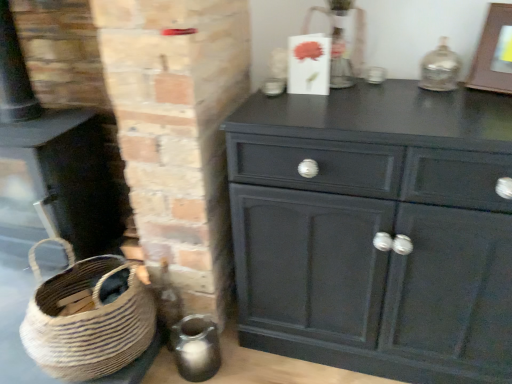
Image resolution: width=512 pixels, height=384 pixels. Find the location of `vacant space that is to the left of wooden picture frame at upper right`. vacant space that is to the left of wooden picture frame at upper right is located at coordinates (471, 101).